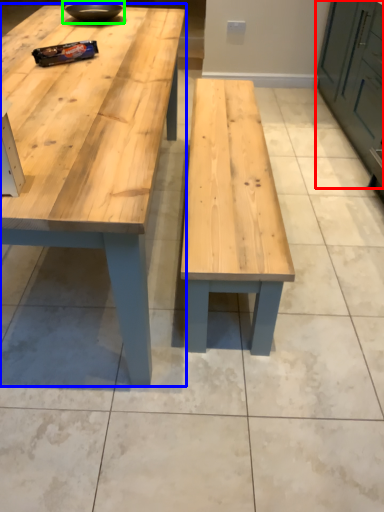
Question: Which object is the closest to the cabinetry (highlighted by a red box)? Choose among these: table (highlighted by a blue box) or bowl (highlighted by a green box).

Choices:
 (A) table
 (B) bowl

Answer: (A)